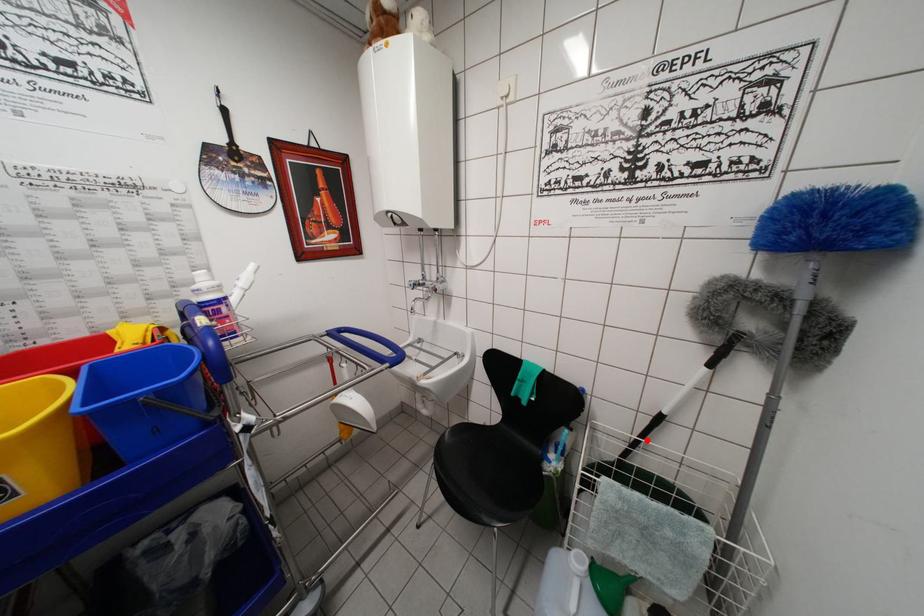
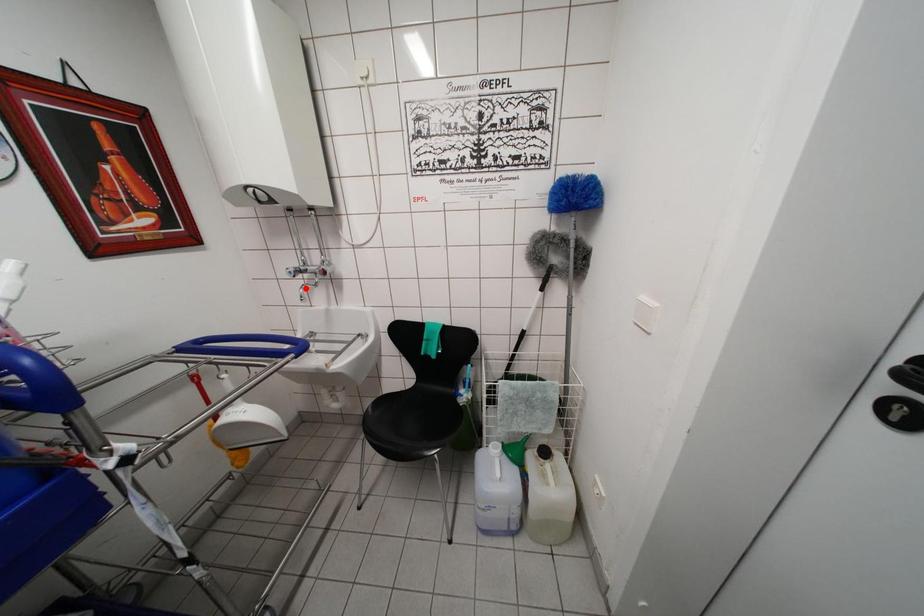
I am providing you with two images of the same scene from different viewpoints. A red point is marked on the first image and another point is marked on the second image. Does the point marked in image1 correspond to the same location as the one in image2?

No